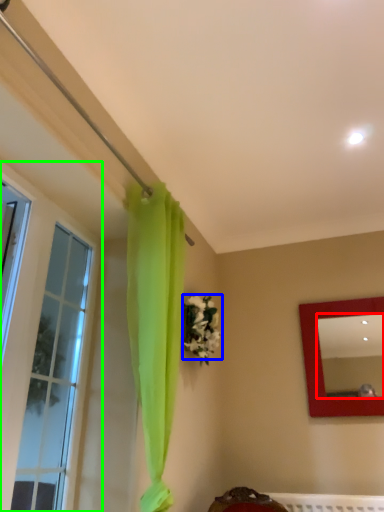
Question: Based on their relative distances, which object is nearer to mirror (highlighted by a red box)? Choose from flower (highlighted by a blue box) and window (highlighted by a green box).

Choices:
 (A) flower
 (B) window

Answer: (A)